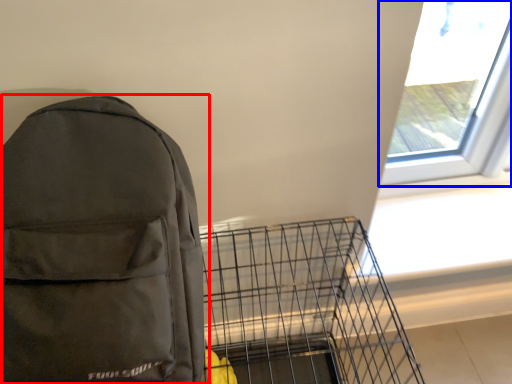
Question: Which of the following is the closest to the observer, backpack (highlighted by a red box) or window (highlighted by a blue box)?

Choices:
 (A) backpack
 (B) window

Answer: (A)